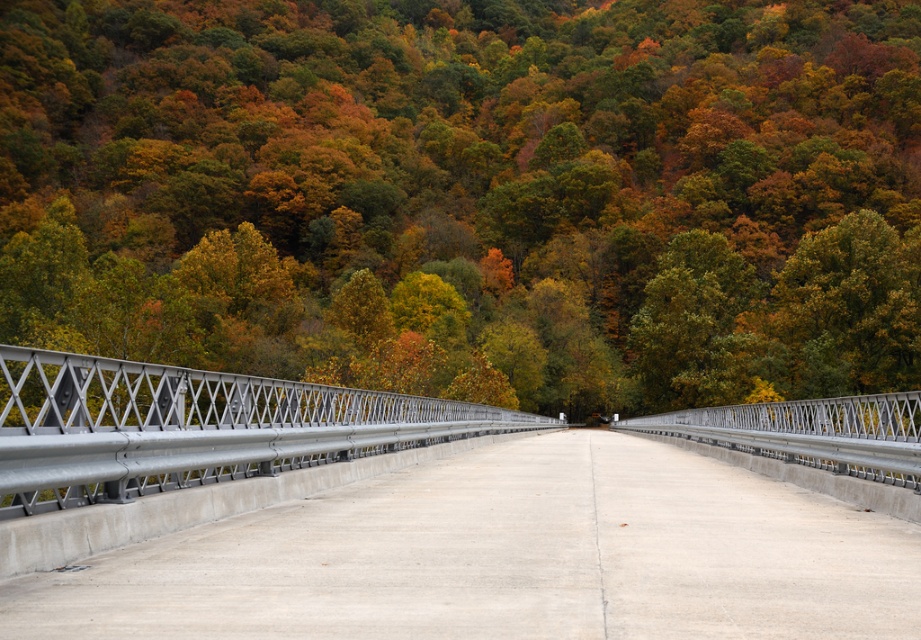
Question: Which point appears farthest from the camera in this image?

Choices:
 (A) (22, 212)
 (B) (178, 538)
 (C) (26, 444)

Answer: (A)

Question: Does metallic gray highway at center have a smaller size compared to metallic gray bridge at center?

Choices:
 (A) yes
 (B) no

Answer: (A)

Question: Among these points, which one is nearest to the camera?

Choices:
 (A) (379, 404)
 (B) (694, 394)
 (C) (6, 209)

Answer: (A)

Question: Estimate the real-world distances between objects in this image. Which object is closer to the metallic bridge at center?

Choices:
 (A) metallic gray highway at center
 (B) metallic gray bridge at center
 (C) green matte tree at center

Answer: (C)

Question: Does metallic gray bridge at center appear over green matte tree at center?

Choices:
 (A) no
 (B) yes

Answer: (A)

Question: Can you confirm if metallic bridge at center is wider than green matte tree at center?

Choices:
 (A) yes
 (B) no

Answer: (A)